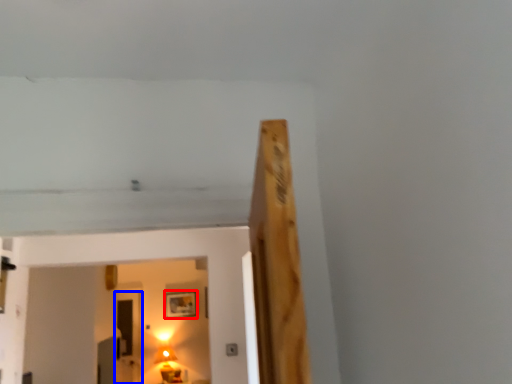
Question: Which object is closer to the camera taking this photo, picture frame (highlighted by a red box) or glass door (highlighted by a blue box)?

Choices:
 (A) picture frame
 (B) glass door

Answer: (B)